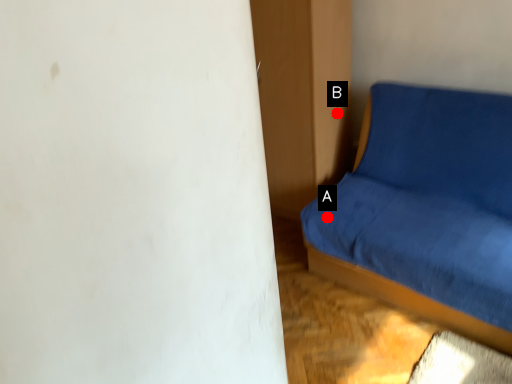
Question: Two points are circled on the image, labeled by A and B beside each circle. Which of the following is the closest to the observer?

Choices:
 (A) A is closer
 (B) B is closer

Answer: (A)